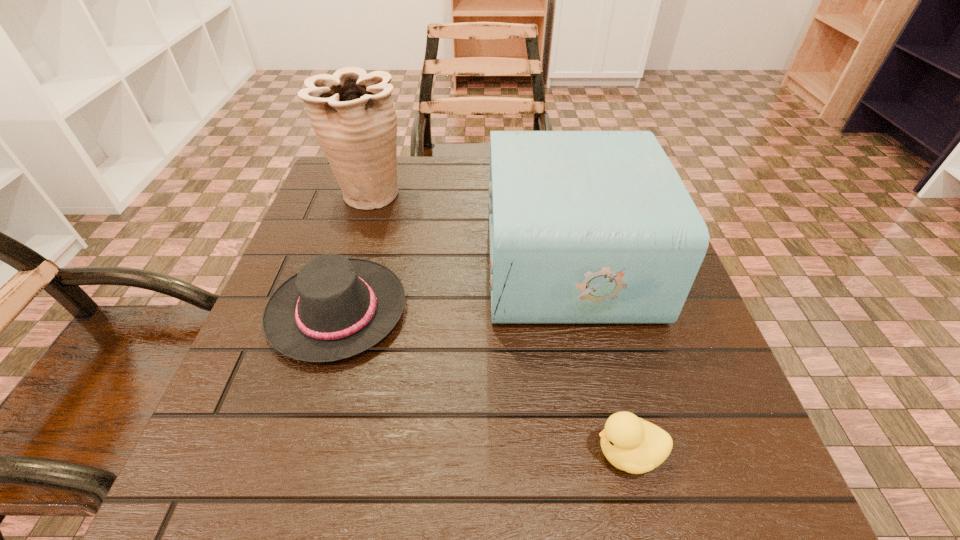
You are a GUI agent. You are given a task and a screenshot of the screen. Output one action in this format:
    pyautogui.click(x=<x>, y=<y>)
    Task: Click on the object present at the far right corner
    The image size is (960, 540).
    Given the screenshot: What is the action you would take?
    pyautogui.click(x=585, y=226)

This screenshot has height=540, width=960. I want to click on object that is at the near right corner, so click(x=632, y=444).

You are a GUI agent. You are given a task and a screenshot of the screen. Output one action in this format:
    pyautogui.click(x=<x>, y=<y>)
    Task: Click on the free spot at the far edge of the desktop
    
    Given the screenshot: What is the action you would take?
    pyautogui.click(x=444, y=198)

I want to click on blank space at the left edge, so click(300, 400).

You are a GUI agent. You are given a task and a screenshot of the screen. Output one action in this format:
    pyautogui.click(x=<x>, y=<y>)
    Task: Click on the free space at the right edge
    
    Given the screenshot: What is the action you would take?
    pyautogui.click(x=617, y=364)

In the image, there is a desktop. Where is `vacant space at the far left corner`? vacant space at the far left corner is located at coordinates (345, 211).

What are the coordinates of `blank region between the second tallest object and the urn` in the screenshot? It's located at (468, 227).

Locate an element on the screen. blank region between the urn and the radio receiver is located at coordinates (468, 227).

Locate an element on the screen. The height and width of the screenshot is (540, 960). vacant space that is in between the dress hat and the third shortest object is located at coordinates (452, 286).

Find the location of a particular element. The width and height of the screenshot is (960, 540). free space between the radio receiver and the nearest object is located at coordinates (597, 357).